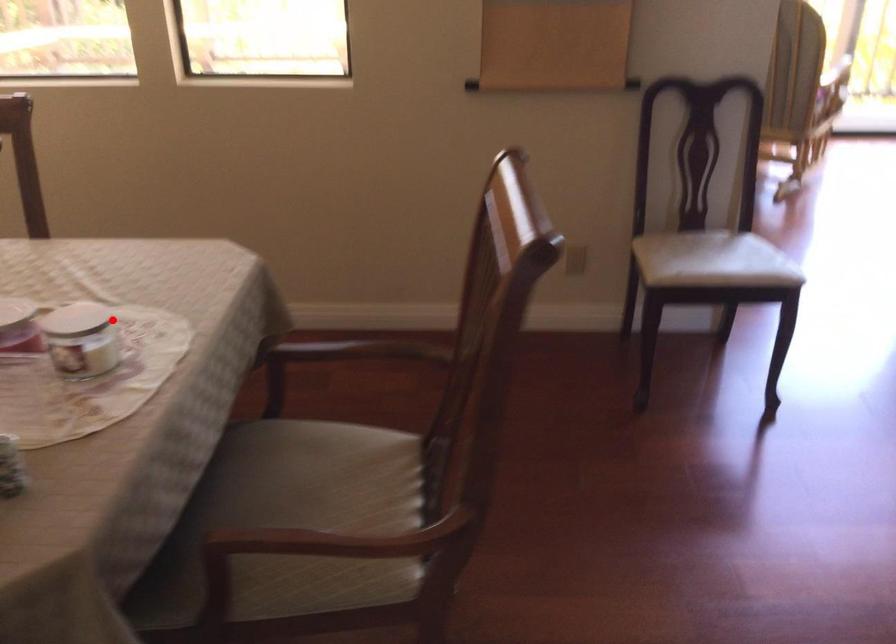
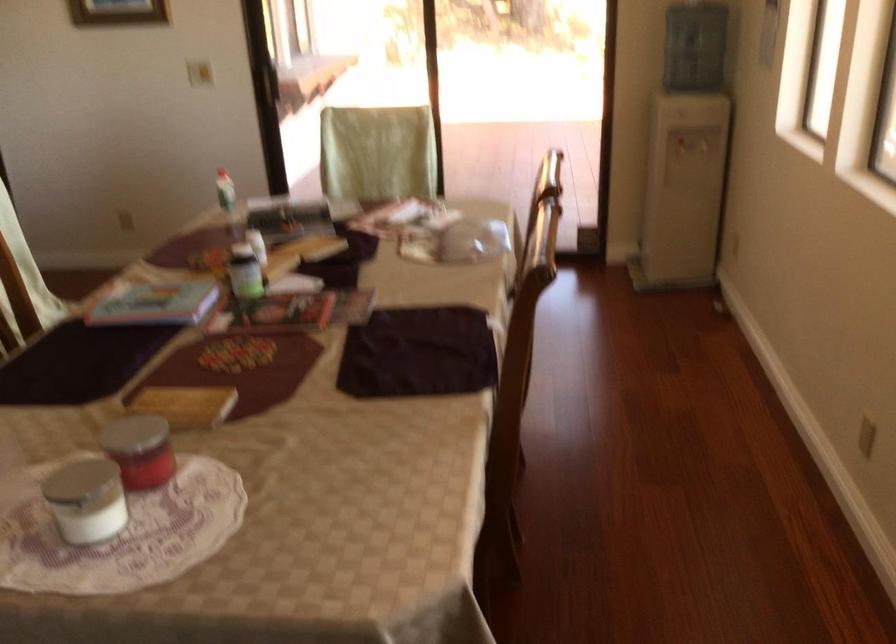
Question: I am providing you with two images of the same scene from different viewpoints. In image1, a red point is highlighted. Considering the same 3D point in image2, which of the following is correct?

Choices:
 (A) It is closer
 (B) It is farther

Answer: (A)